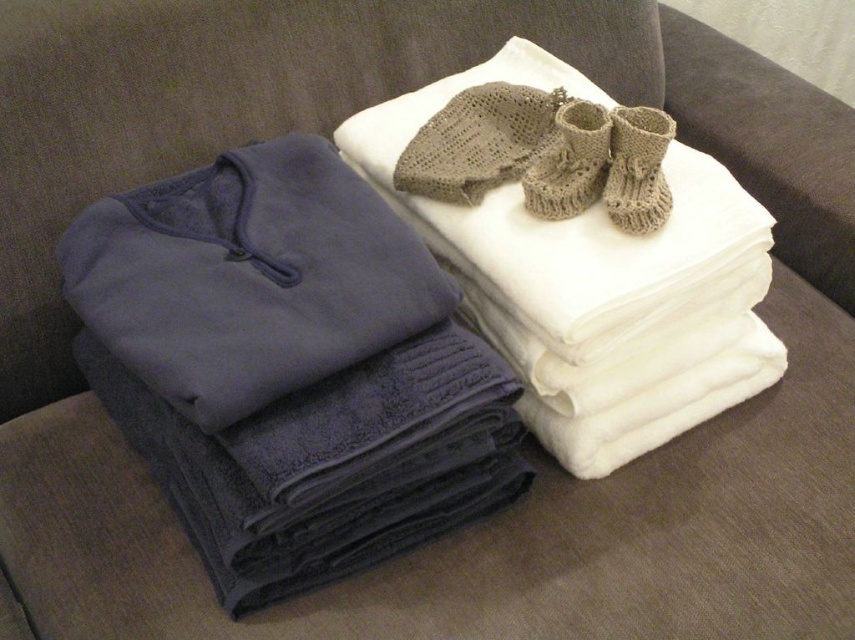
Who is positioned more to the right, knitted beige booties at upper center or knitted beige booties at upper right?

Positioned to the right is knitted beige booties at upper right.

Does knitted beige booties at upper center have a larger size compared to knitted beige booties at upper right?

Correct, knitted beige booties at upper center is larger in size than knitted beige booties at upper right.

Locate an element on the screen. Image resolution: width=855 pixels, height=640 pixels. knitted beige booties at upper center is located at coordinates (568, 161).

Locate an element on the screen. This screenshot has width=855, height=640. knitted beige booties at upper center is located at coordinates pyautogui.click(x=568, y=161).

Does navy fleece sweater at left appear over knitted beige booties at upper center?

Incorrect, navy fleece sweater at left is not positioned above knitted beige booties at upper center.

Who is positioned more to the left, navy fleece sweater at left or knitted beige booties at upper center?

From the viewer's perspective, navy fleece sweater at left appears more on the left side.

Find the location of a particular element. This screenshot has height=640, width=855. navy fleece sweater at left is located at coordinates (249, 276).

Consider the image. Does navy fleece sweater at left have a smaller size compared to knitted beige booties at upper right?

Incorrect, navy fleece sweater at left is not smaller in size than knitted beige booties at upper right.

Measure the distance between navy fleece sweater at left and camera.

navy fleece sweater at left is 27.49 inches away from camera.

At what (x,y) coordinates should I click in order to perform the action: click on navy fleece sweater at left. Please return your answer as a coordinate pair (x, y). This screenshot has width=855, height=640. Looking at the image, I should click on (249, 276).